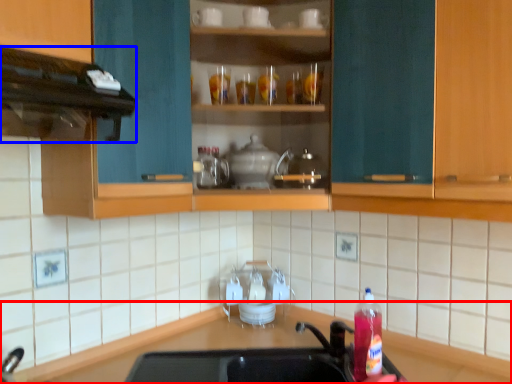
Question: Among these objects, which one is nearest to the camera, countertop (highlighted by a red box) or vent (highlighted by a blue box)?

Choices:
 (A) countertop
 (B) vent

Answer: (A)